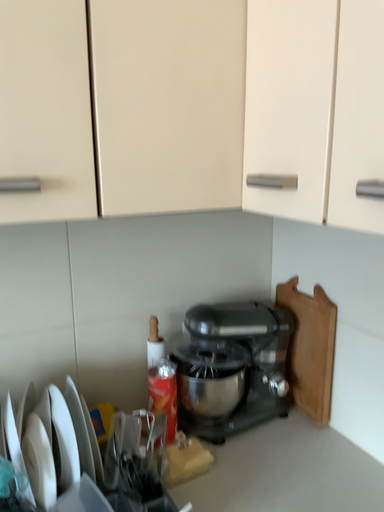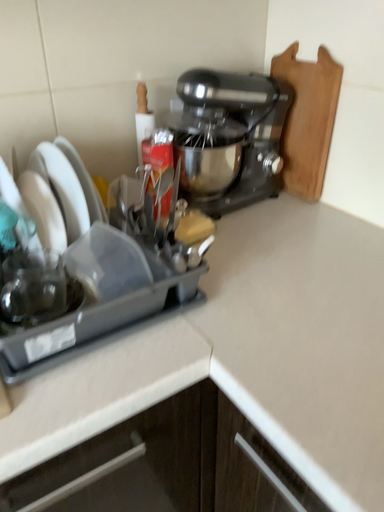
Question: How did the camera likely rotate when shooting the video?

Choices:
 (A) rotated downward
 (B) rotated upward

Answer: (A)